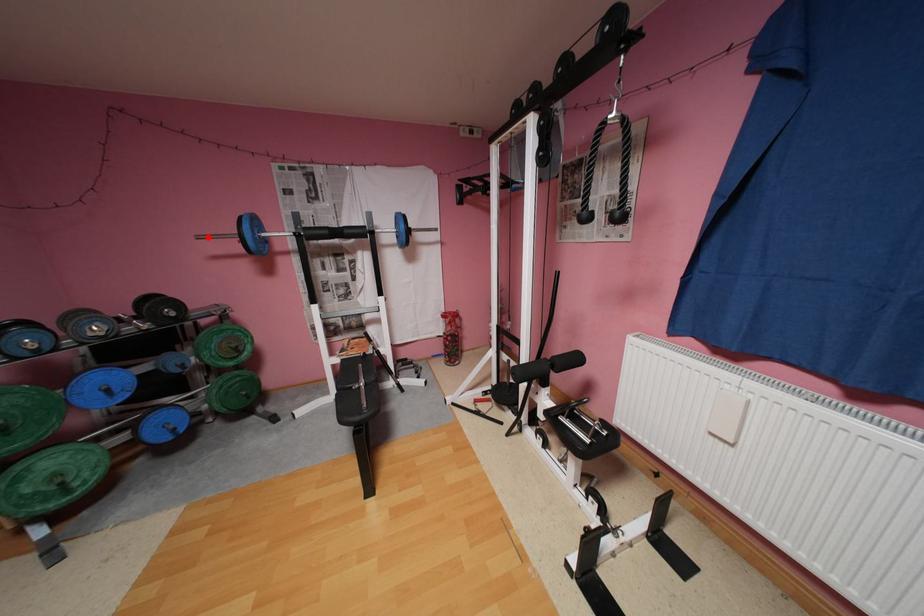
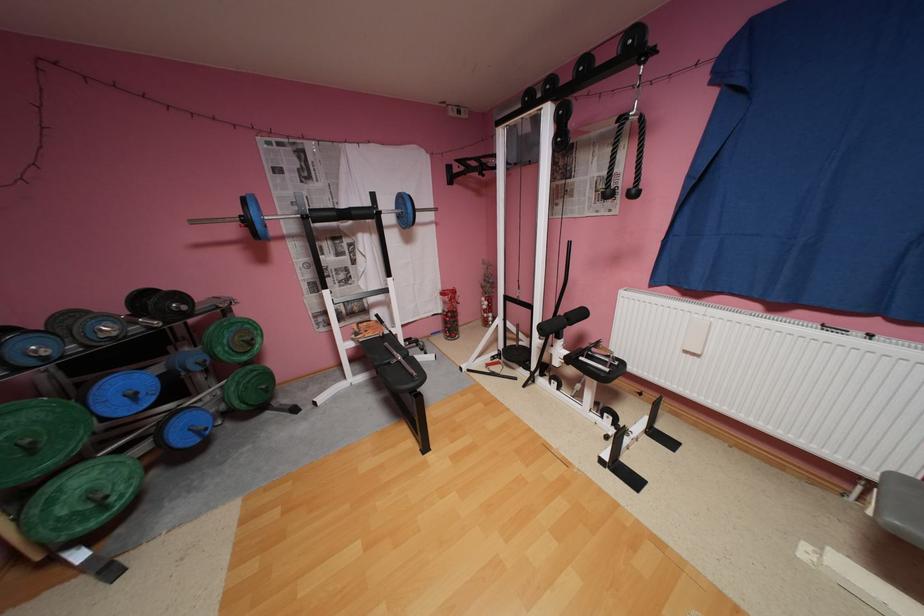
The point at the highlighted location is marked in the first image. Where is the corresponding point in the second image?

(202, 223)